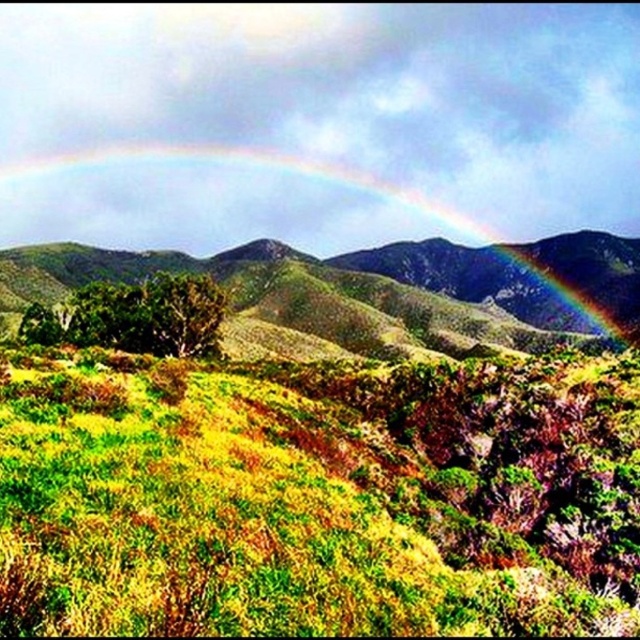
Can you confirm if green grassy at center is positioned below rainbow at upper center?

Correct, green grassy at center is located below rainbow at upper center.

Does green grassy at center lie behind rainbow at upper center?

No.

Find the location of a particular element. The width and height of the screenshot is (640, 640). green grassy at center is located at coordinates (321, 497).

You are a GUI agent. You are given a task and a screenshot of the screen. Output one action in this format:
    pyautogui.click(x=<x>, y=<y>)
    Task: Click on the green grassy at center
    This screenshot has height=640, width=640.
    Given the screenshot: What is the action you would take?
    pyautogui.click(x=321, y=497)